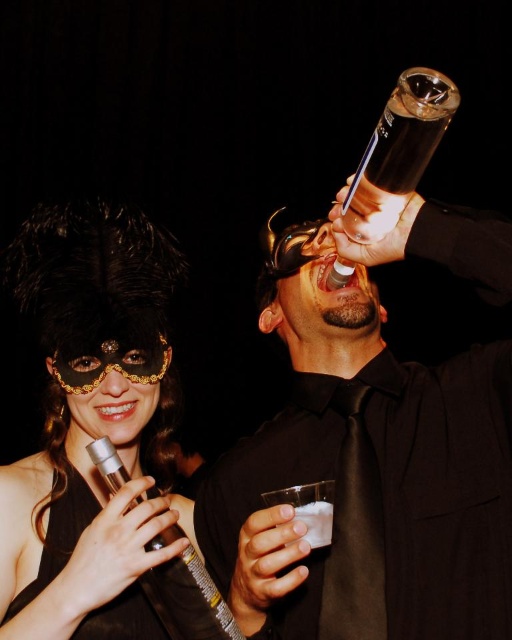
You are a stagehand at the event and need to determine which object is larger between the silver metallic microphone at lower left and the clear glass at upper center. Based on the scene description, can you identify the larger object?

The silver metallic microphone at lower left is bigger than the clear glass at upper center.

You are at a party and see the shiny black bottle at upper center and the clear glass at upper center. Which one is positioned to the right?

The shiny black bottle at upper center is positioned to the right of the clear glass at upper center.

You are a photographer adjusting your camera to focus on two points in the image. The first point is point (x=339, y=232) and the second is point (x=332, y=506). Which point should you focus on first to ensure the closest object is sharp?

Point (x=339, y=232) is closer to the viewer than point (x=332, y=506), so you should focus on point (x=339, y=232) first to ensure the closest object is sharp.